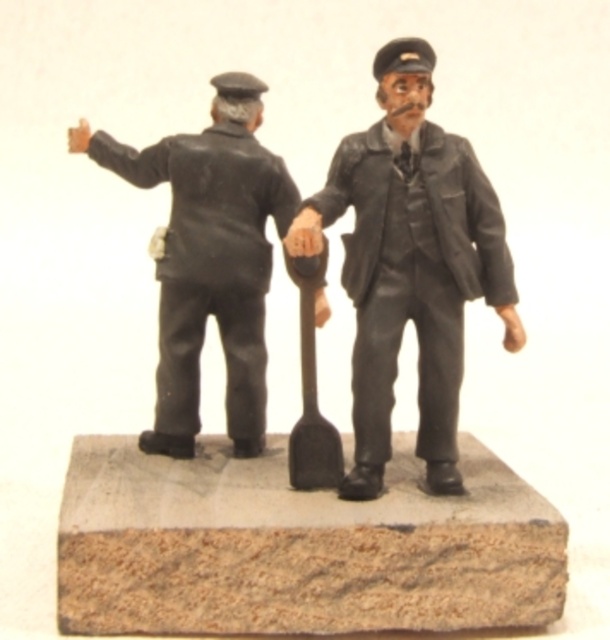
You are a worker in the scene and need to place a new tool on the ground. The tool must be placed on the larger object between the brown wood at center and the matte black uniform at center. Which object should you choose?

The brown wood at center is bigger than the matte black uniform at center, so you should place the tool on the brown wood at center.

You are a visitor observing the miniature scene. You notice the brown wood at center and the metallic gray shovel at center. Which object is positioned nearer to your viewpoint?

The brown wood at center is closer to the viewer than the metallic gray shovel at center.

Based on the photo, you are a visitor observing the miniature scene. You want to know which object is nearer to you between the matte black uniform at center and the matte black figure at left. Can you determine this based on their positions?

Answer: The matte black uniform at center is closer to the viewer than the matte black figure at left, so the matte black uniform at center is nearer to you.